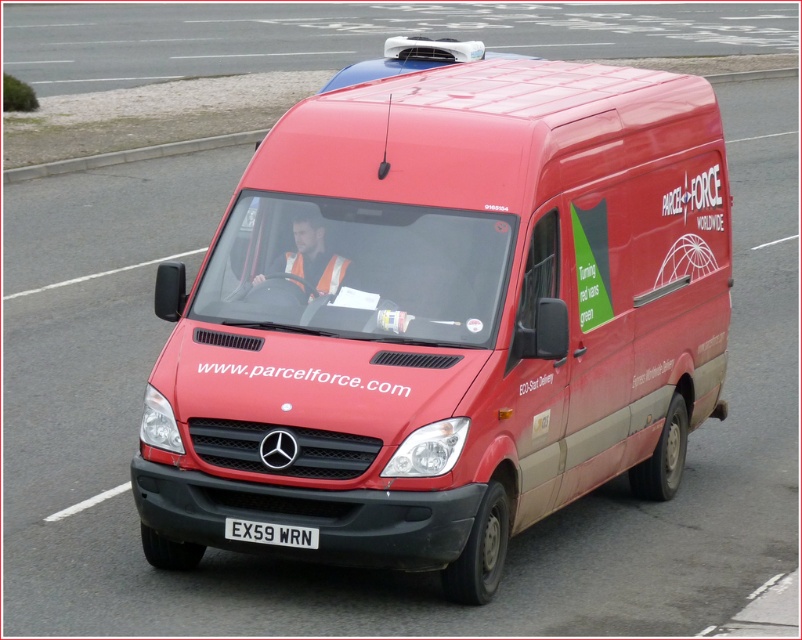
Between matte red van at center and reflective orange vest at center, which one appears on the left side from the viewer's perspective?

reflective orange vest at center is more to the left.

Who is lower down, matte red van at center or reflective orange vest at center?

Positioned lower is matte red van at center.

Does point (659, 77) lie behind point (310, 224)?

Yes, point (659, 77) is farther from viewer.

At what (x,y) coordinates should I click in order to perform the action: click on matte red van at center. Please return your answer as a coordinate pair (x, y). The width and height of the screenshot is (802, 640). Looking at the image, I should click on (446, 314).

The image size is (802, 640). What do you see at coordinates (446, 314) in the screenshot? I see `matte red van at center` at bounding box center [446, 314].

I want to click on matte red van at center, so click(x=446, y=314).

Locate an element on the screen. matte red van at center is located at coordinates (446, 314).

Measure the distance from reflective orange vest at center to white plastic license plate at center.

reflective orange vest at center and white plastic license plate at center are 5.34 feet apart from each other.

Where is `reflective orange vest at center`? The image size is (802, 640). reflective orange vest at center is located at coordinates (312, 257).

Identify the location of reflective orange vest at center. The width and height of the screenshot is (802, 640). (312, 257).